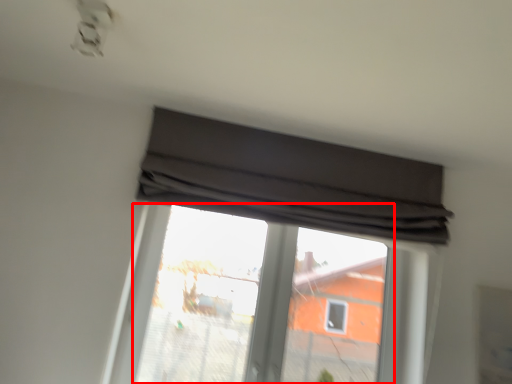
Question: From the image's perspective, considering the relative positions of bay window (annotated by the red box) and window in the image provided, where is bay window (annotated by the red box) located with respect to the staircase?

Choices:
 (A) above
 (B) below

Answer: (B)